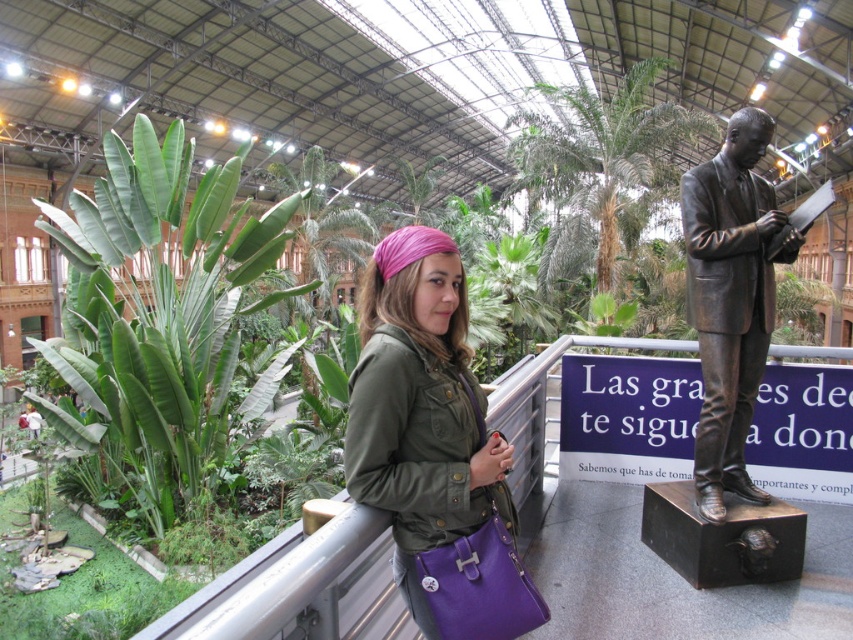
Does green leafy plant at lower left have a lesser width compared to green leafy plant at center?

Yes, green leafy plant at lower left is thinner than green leafy plant at center.

Can you confirm if green leafy plant at lower left is positioned above green leafy plant at center?

No, green leafy plant at lower left is not above green leafy plant at center.

Is point (3, 580) behind point (778, 268)?

No.

Where is `green leafy plant at lower left`? This screenshot has height=640, width=853. green leafy plant at lower left is located at coordinates (85, 593).

What do you see at coordinates (421, 410) in the screenshot?
I see `matte green jacket at center` at bounding box center [421, 410].

Between matte green jacket at center and green leafy plant at lower left, which one appears on the right side from the viewer's perspective?

matte green jacket at center

Locate an element on the screen. matte green jacket at center is located at coordinates (421, 410).

In order to click on matte green jacket at center in this screenshot , I will do `click(421, 410)`.

Is point (113, 186) farther from viewer compared to point (791, 291)?

No, (113, 186) is closer to viewer.

Does green leafy plant at left appear on the left side of green leafy plant at center?

Indeed, green leafy plant at left is positioned on the left side of green leafy plant at center.

What are the coordinates of `green leafy plant at left` in the screenshot? It's located at (161, 321).